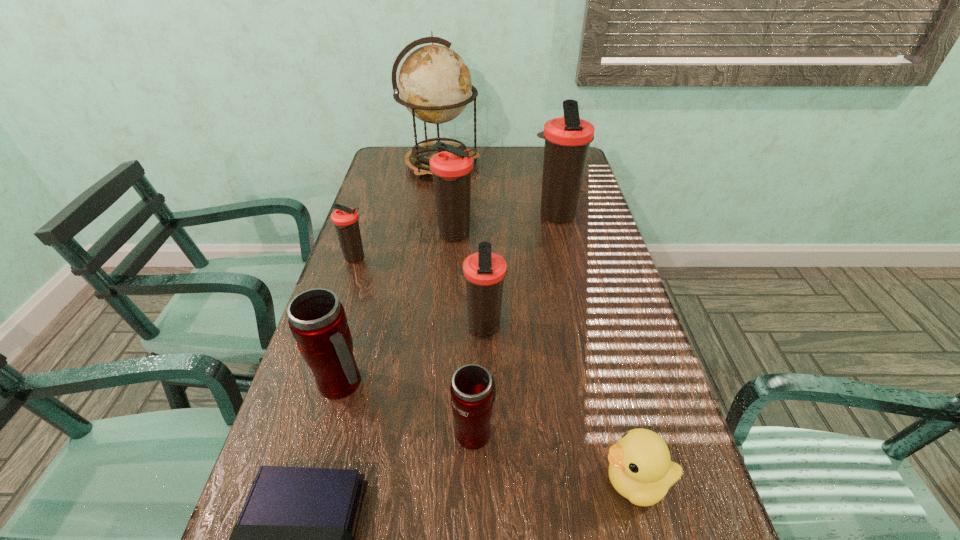
Where is `vacant space situated 0.350m on the side with the handle of the farther red thermos bottle`? This screenshot has width=960, height=540. vacant space situated 0.350m on the side with the handle of the farther red thermos bottle is located at coordinates (529, 383).

You are a GUI agent. You are given a task and a screenshot of the screen. Output one action in this format:
    pyautogui.click(x=<x>, y=<y>)
    Task: Click on the vacant area situated 0.330m on the side with the handle of the nearest thermos bottle
    The height and width of the screenshot is (540, 960).
    Given the screenshot: What is the action you would take?
    pyautogui.click(x=476, y=299)

The width and height of the screenshot is (960, 540). In order to click on vacant space located 0.330m on the side with the handle of the nearest thermos bottle in this screenshot , I will do `click(476, 299)`.

The image size is (960, 540). I want to click on vacant space located 0.390m on the side with the handle of the nearest thermos bottle, so click(476, 284).

Image resolution: width=960 pixels, height=540 pixels. I want to click on free space located on the right of the third farthest thermos bottle, so click(393, 258).

This screenshot has height=540, width=960. Identify the location of free space located 0.150m on the face of the duck. (516, 482).

Identify the location of free spot located on the face of the duck. The width and height of the screenshot is (960, 540). (378, 482).

Identify the location of vacant space situated 0.300m on the face of the duck. The height and width of the screenshot is (540, 960). (433, 482).

Identify the location of object positioned at the far edge. This screenshot has width=960, height=540. (434, 83).

Locate an element on the screen. This screenshot has width=960, height=540. globe situated at the left edge is located at coordinates (434, 83).